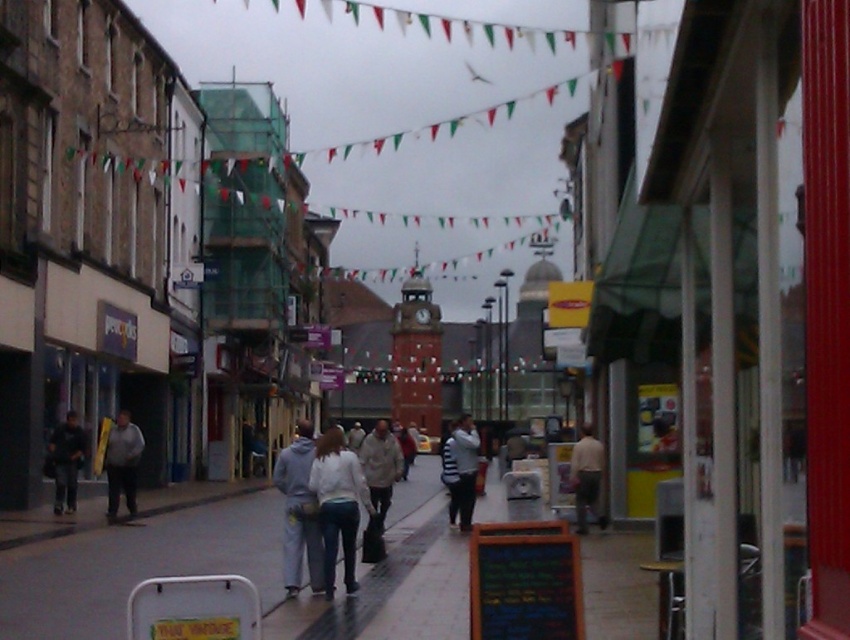
You are a delivery person needing to place a heavy box on the ground. You see the smooth concrete pavement at center and the black chalkboard at lower right. Which surface is suitable for placing the box without damaging it?

The smooth concrete pavement at center is suitable for placing the box without damaging it because it is a solid surface, whereas the black chalkboard at lower right is likely fragile and not meant to support heavy items.

You are a photographer standing on the sidewalk in the town center, and you want to take a photo of the chalkboard menu. You notice two people in the foreground wearing a light beige fabric jacket at center and a striped sweater at center. Which clothing item is closer to you, the photographer?

The light beige fabric jacket at center is closer to you because it is in front of the striped sweater at center.

You are a delivery person who needs to place a large package on the ground. You see the smooth concrete pavement at center and the dark gray hoodie at left. Which surface is more suitable for placing the package?

The smooth concrete pavement at center is more suitable for placing the package because it has a larger size compared to the dark gray hoodie at left.